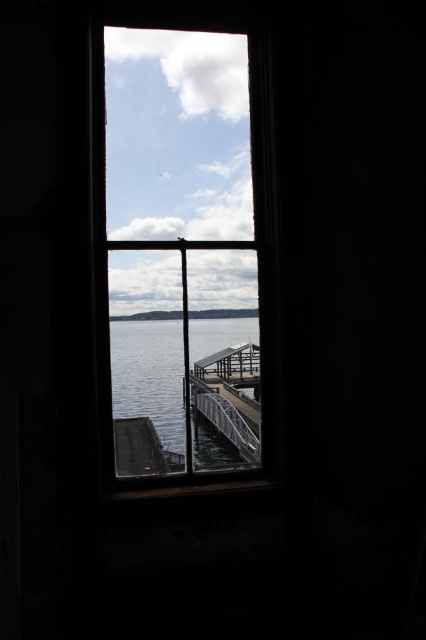
Who is shorter, wooden frame at center or clear water at center?

Standing shorter between the two is clear water at center.

The image size is (426, 640). What do you see at coordinates (184, 257) in the screenshot?
I see `wooden frame at center` at bounding box center [184, 257].

Where is `wooden frame at center`? The image size is (426, 640). wooden frame at center is located at coordinates (184, 257).

Who is higher up, wooden frame at center or metallic gray rail at center?

wooden frame at center is higher up.

Does wooden frame at center have a smaller size compared to metallic gray rail at center?

Incorrect, wooden frame at center is not smaller in size than metallic gray rail at center.

Identify the location of wooden frame at center. (184, 257).

Can you confirm if metallic gray dock at center is taller than metallic gray rail at center?

Yes, metallic gray dock at center is taller than metallic gray rail at center.

Does metallic gray dock at center have a greater width compared to metallic gray rail at center?

Indeed, metallic gray dock at center has a greater width compared to metallic gray rail at center.

Which is behind, point (238, 353) or point (229, 429)?

Positioned behind is point (238, 353).

You are a GUI agent. You are given a task and a screenshot of the screen. Output one action in this format:
    pyautogui.click(x=<x>, y=<y>)
    Task: Click on the metallic gray dock at center
    The width and height of the screenshot is (426, 640).
    Given the screenshot: What is the action you would take?
    pyautogui.click(x=230, y=396)